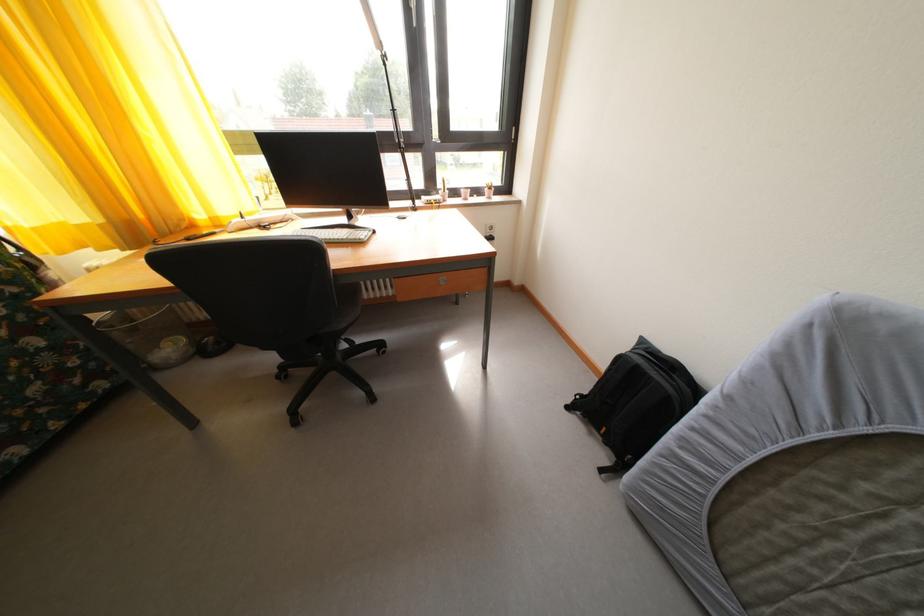
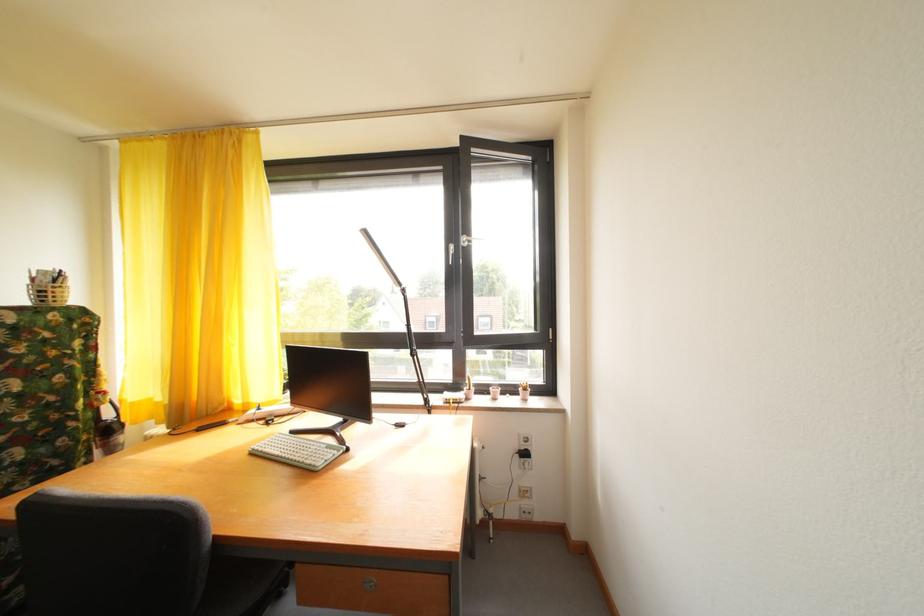
Question: I am providing you with two images of the same scene from different viewpoints. Please identify which objects are invisible in image2.

Choices:
 (A) window handle
 (B) drawer lock
 (C) keyboard
 (D) none of these

Answer: (D)